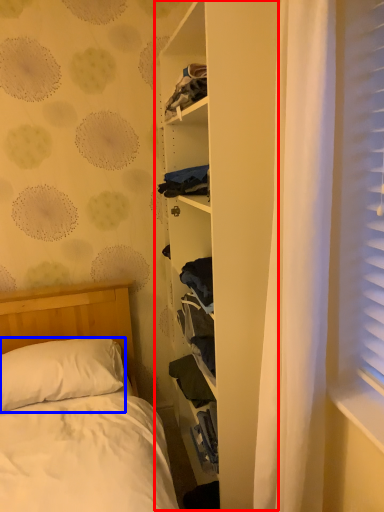
Question: Which object appears farthest to the camera in this image, bookshelf (highlighted by a red box) or pillow (highlighted by a blue box)?

Choices:
 (A) bookshelf
 (B) pillow

Answer: (B)